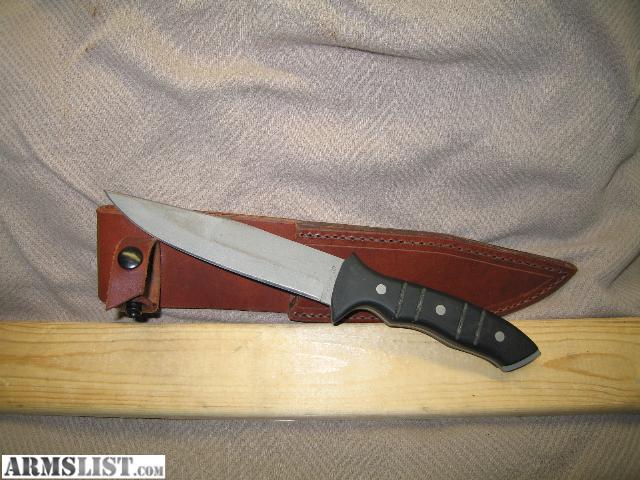
The image size is (640, 480). What are the coordinates of `knife handle` in the screenshot? It's located at (400, 300).